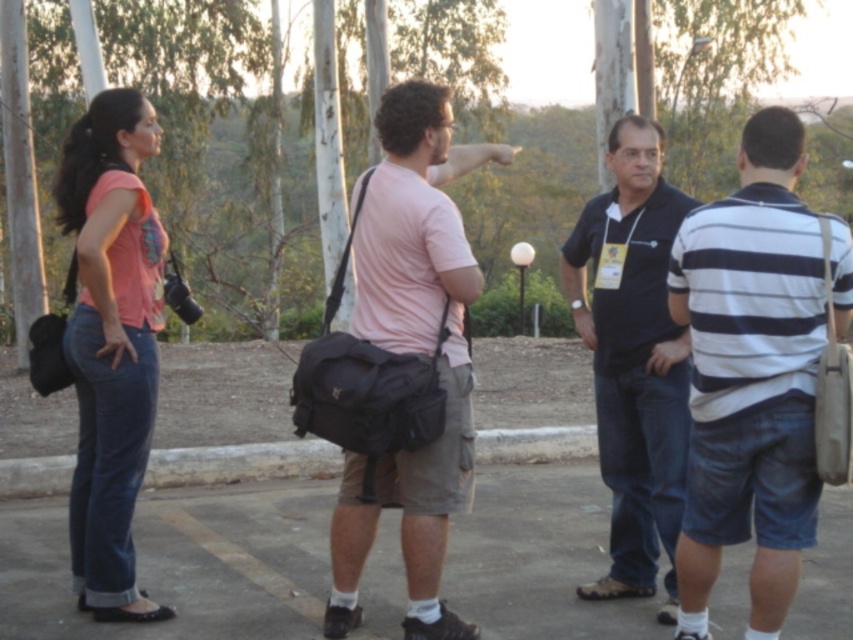
Question: Which object is positioned farthest from the white striped shirt at right?

Choices:
 (A) dark blue shirt at center
 (B) matte pink shirt at left
 (C) pink matte t-shirt at center

Answer: (B)

Question: Does white striped shirt at right have a smaller size compared to dark blue shirt at center?

Choices:
 (A) yes
 (B) no

Answer: (A)

Question: Which point is farther to the camera?

Choices:
 (A) white striped shirt at right
 (B) dark blue shirt at center

Answer: (B)

Question: Which point is closer to the camera?

Choices:
 (A) pink matte t-shirt at center
 (B) matte pink shirt at left

Answer: (A)

Question: Is white striped shirt at right above matte pink shirt at left?

Choices:
 (A) yes
 (B) no

Answer: (B)

Question: Is pink matte t-shirt at center bigger than matte pink shirt at left?

Choices:
 (A) no
 (B) yes

Answer: (B)